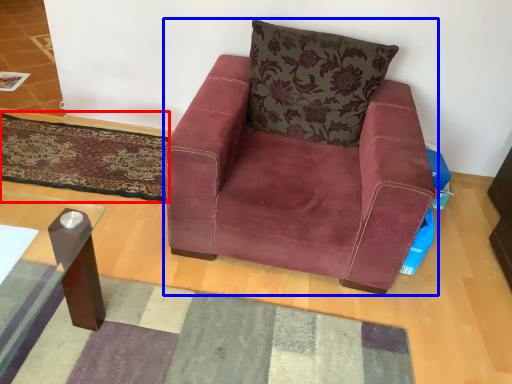
Question: Which point is further to the camera, mat (highlighted by a red box) or chair (highlighted by a blue box)?

Choices:
 (A) mat
 (B) chair

Answer: (A)